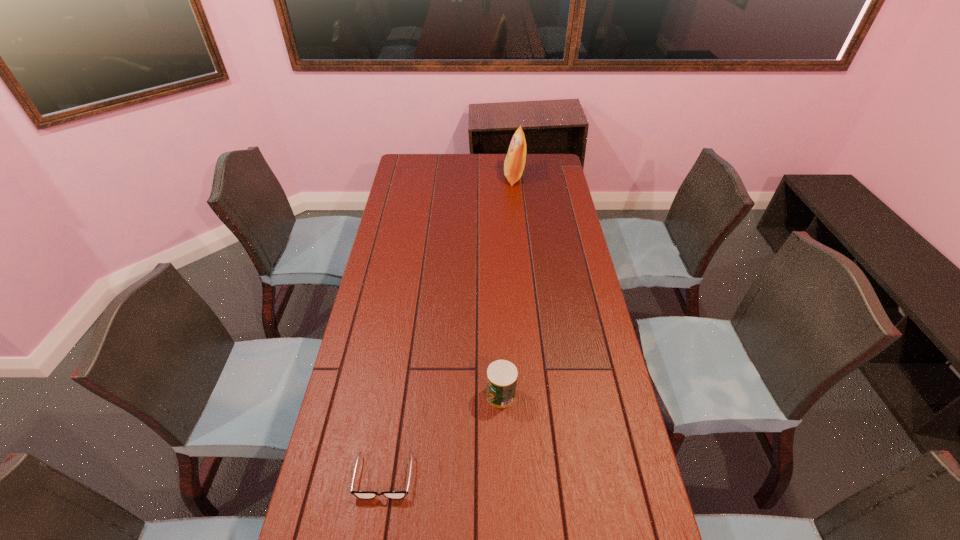
Locate an element on the screen. vacant area between the rightmost object and the second shortest object is located at coordinates (508, 286).

Where is `vacant space in between the second tallest object and the leftmost object`? This screenshot has width=960, height=540. vacant space in between the second tallest object and the leftmost object is located at coordinates (443, 436).

What are the coordinates of `free space between the crisp (potato chip) and the nearest object` in the screenshot? It's located at (449, 327).

Locate an element on the screen. Image resolution: width=960 pixels, height=540 pixels. free space between the farthest object and the second object from right to left is located at coordinates (508, 286).

Locate an element on the screen. This screenshot has width=960, height=540. vacant area that lies between the rightmost object and the shortest object is located at coordinates (449, 327).

What are the coordinates of `free spot between the leftmost object and the farthest object` in the screenshot? It's located at (449, 327).

Locate an element on the screen. object that can be found as the closest to the leftmost object is located at coordinates (501, 375).

Identify which object is the nearest to the second object from right to left. Please provide its 2D coordinates. Your answer should be formatted as a tuple, i.e. [(x, y)], where the tuple contains the x and y coordinates of a point satisfying the conditions above.

[(359, 494)]

The height and width of the screenshot is (540, 960). I want to click on free spot that satisfies the following two spatial constraints: 1. on the front-facing side of the crisp (potato chip); 2. on the front-facing side of the shortest object, so click(545, 477).

Find the location of a particular element. free space that satisfies the following two spatial constraints: 1. on the front-facing side of the crisp (potato chip); 2. on the front-facing side of the leftmost object is located at coordinates (545, 477).